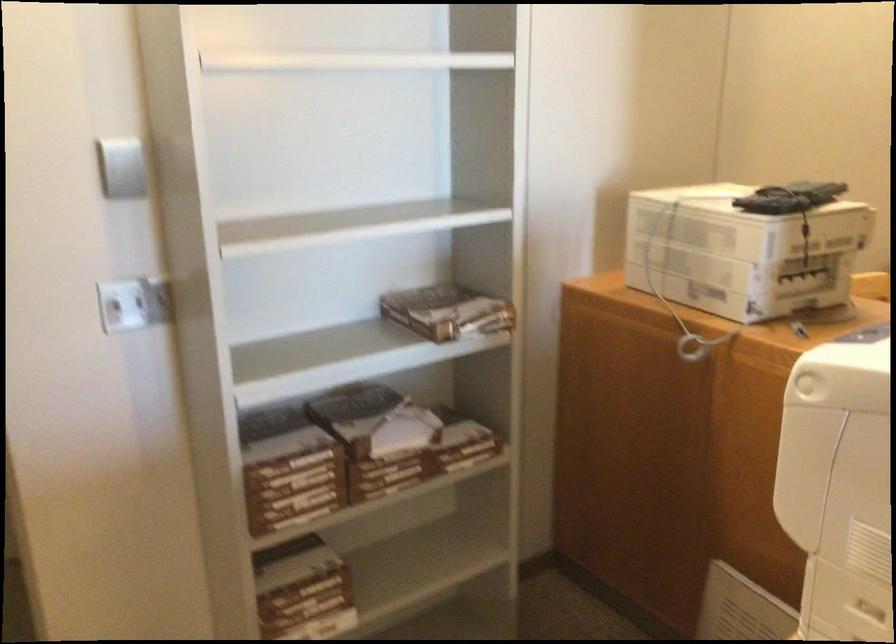
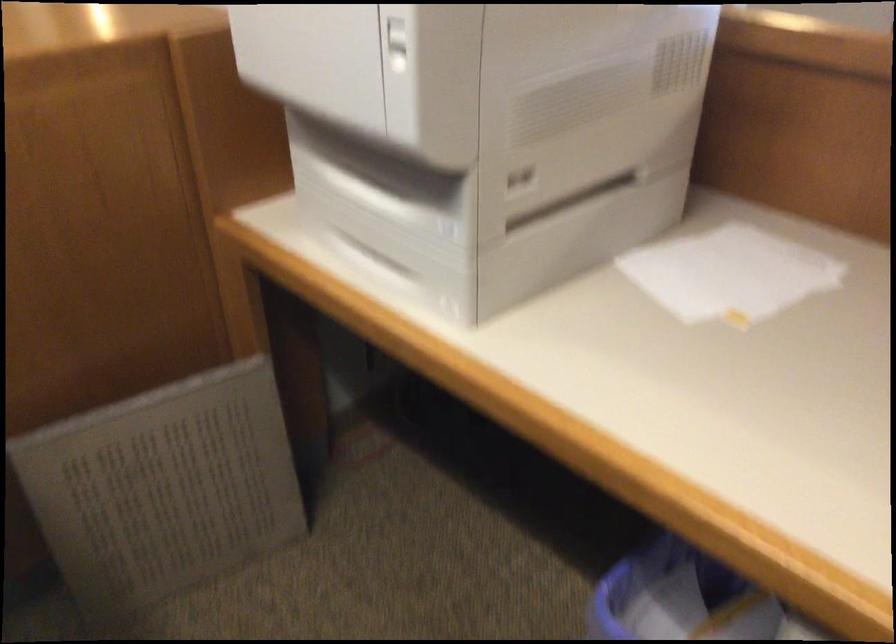
In the second image, find the point that corresponds to point 823,453 in the first image.

(397, 44)